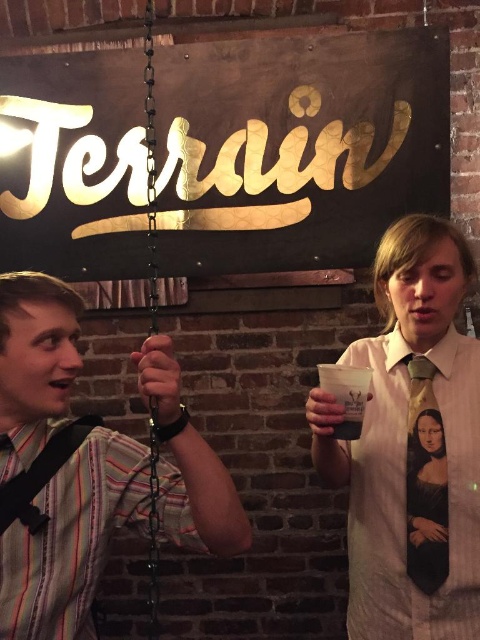
Consider the image. You are organizing a fashion show and need to ensure that all accessories match the size of the clothing items. Given the white silk shirt at center and the matte green tie at center, which item would you adjust to ensure proper proportion? Please explain your reasoning.

The white silk shirt at center is larger than the matte green tie at center. To ensure proper proportion, you would adjust the size of the matte green tie at center to be larger to match the scale of the white silk shirt at center.

Based on the photo, you are standing in front of the two people in the image. Which of the two points, point [419,417] or point [360,406], is closer to you?

Point [419,417] is closer to you because it is further to the viewer than point [360,406].